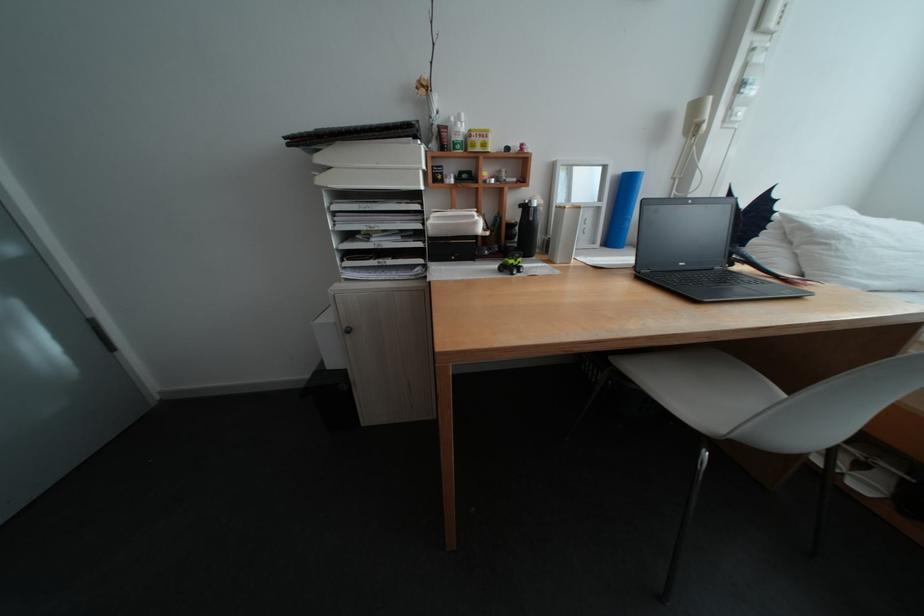
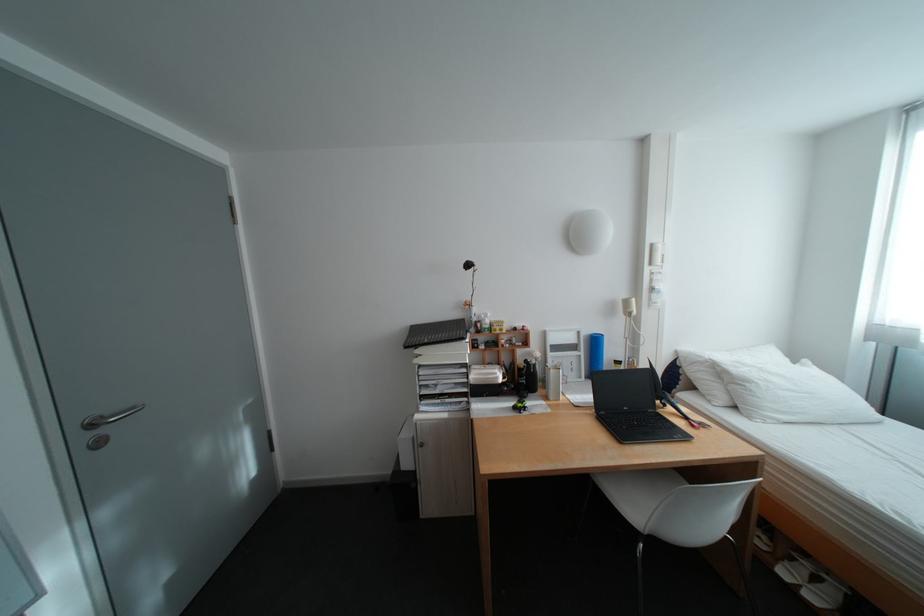
Locate, in the second image, the point that corresponds to the point at 501,235 in the first image.

(518, 381)